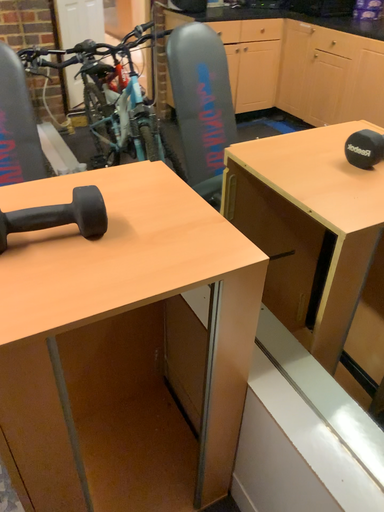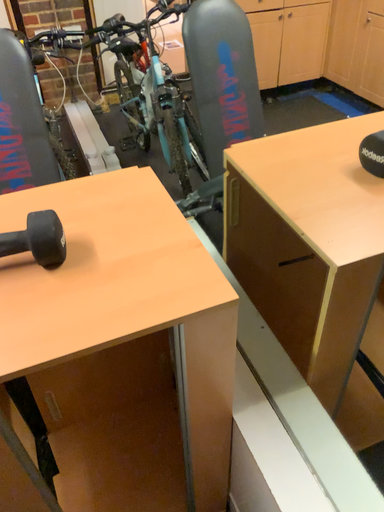
Question: Which way did the camera rotate in the video?

Choices:
 (A) rotated left
 (B) rotated right

Answer: (A)